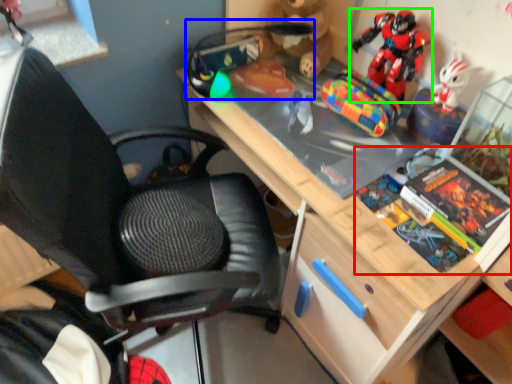
Question: Which object is positioned farthest from book (highlighted by a red box)? Select from toy (highlighted by a blue box) and toy (highlighted by a green box).

Choices:
 (A) toy
 (B) toy

Answer: (A)